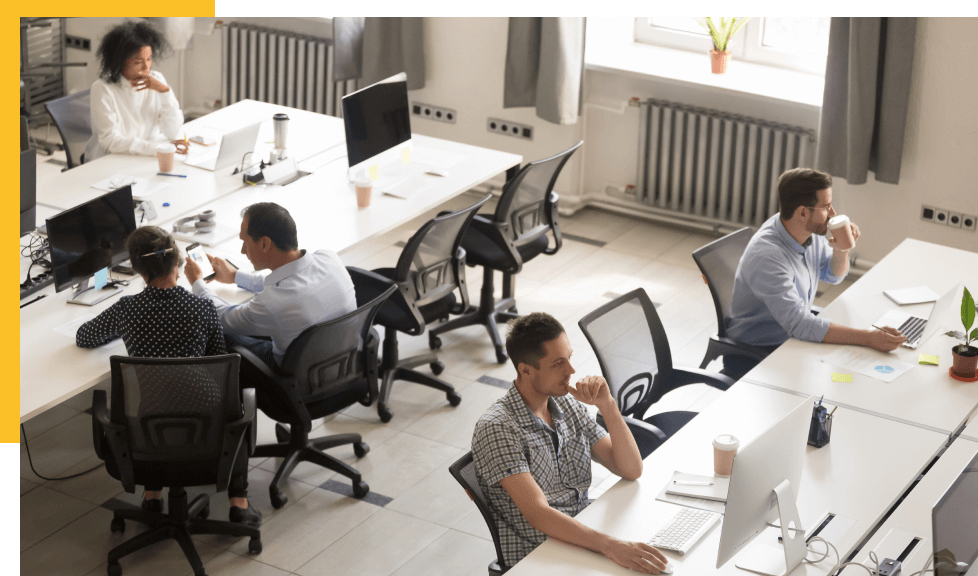
At what (x,y) coordinates should I click in order to perform the action: click on window curtains. Please return your answer as a coordinate pair (x, y). This screenshot has height=576, width=978. Looking at the image, I should click on (867, 73), (530, 48), (376, 43), (173, 20).